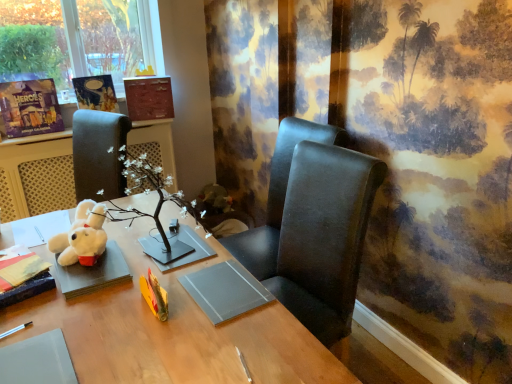
Question: Which direction should I rotate to look at matte black chair at center, which is the 1th chair in top-to-bottom order?

Choices:
 (A) right
 (B) left

Answer: (A)

Question: Does matte paper book at upper left, which is counted as the second book, starting from the back, have a larger size compared to white plush toy at left?

Choices:
 (A) yes
 (B) no

Answer: (B)

Question: Is white plush toy at left a part of matte paper book at upper left, which is counted as the 3th book, starting from the bottom?

Choices:
 (A) no
 (B) yes

Answer: (A)

Question: Considering the relative sizes of matte paper book at upper left, the second book positioned from the top, and white plush toy at left in the image provided, is matte paper book at upper left, the second book positioned from the top, smaller than white plush toy at left?

Choices:
 (A) no
 (B) yes

Answer: (B)

Question: Is matte paper book at upper left, which is counted as the 3th book, starting from the bottom, closer to camera compared to white plush toy at left?

Choices:
 (A) no
 (B) yes

Answer: (A)

Question: Considering the relative sizes of matte paper book at upper left, which is counted as the 3th book, starting from the bottom, and white plush toy at left in the image provided, is matte paper book at upper left, which is counted as the 3th book, starting from the bottom, wider than white plush toy at left?

Choices:
 (A) yes
 (B) no

Answer: (B)

Question: Is matte paper book at upper left, which is counted as the 3th book, starting from the bottom, shorter than white plush toy at left?

Choices:
 (A) no
 (B) yes

Answer: (B)

Question: Does black leather chair at center, which is counted as the 1th chair, starting from the bottom, have a larger size compared to matte black chair at center, which is the second chair in bottom-to-top order?

Choices:
 (A) yes
 (B) no

Answer: (A)

Question: Considering the relative positions of black leather chair at center, which is counted as the 1th chair, starting from the bottom, and matte black chair at center, which is the second chair in bottom-to-top order, in the image provided, is black leather chair at center, which is counted as the 1th chair, starting from the bottom, in front of matte black chair at center, which is the second chair in bottom-to-top order,?

Choices:
 (A) yes
 (B) no

Answer: (A)

Question: Considering the relative sizes of black leather chair at center, acting as the second chair starting from the top, and matte black chair at center, which is the 1th chair in top-to-bottom order, in the image provided, is black leather chair at center, acting as the second chair starting from the top, shorter than matte black chair at center, which is the 1th chair in top-to-bottom order,?

Choices:
 (A) yes
 (B) no

Answer: (B)

Question: Can you confirm if black leather chair at center, which is counted as the 1th chair, starting from the bottom, is wider than matte black chair at center, which is the second chair in bottom-to-top order?

Choices:
 (A) yes
 (B) no

Answer: (B)

Question: Is black leather chair at center, which is counted as the 1th chair, starting from the bottom, smaller than matte black chair at center, which is the second chair in bottom-to-top order?

Choices:
 (A) no
 (B) yes

Answer: (A)

Question: Would you say black leather chair at center, which is counted as the 1th chair, starting from the bottom, is outside matte black chair at center, which is the 1th chair in top-to-bottom order?

Choices:
 (A) no
 (B) yes

Answer: (B)

Question: Is white plush toy at left surrounded by matte brown book at upper center, the first book viewed from the back?

Choices:
 (A) no
 (B) yes

Answer: (A)